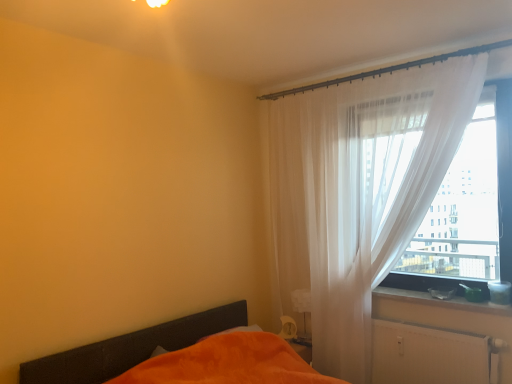
What do you see at coordinates (468, 207) in the screenshot? The height and width of the screenshot is (384, 512). I see `transparent fabric at right` at bounding box center [468, 207].

Where is `white matte radiator at lower right`? The width and height of the screenshot is (512, 384). white matte radiator at lower right is located at coordinates (430, 355).

Image resolution: width=512 pixels, height=384 pixels. What do you see at coordinates (430, 355) in the screenshot? I see `white matte radiator at lower right` at bounding box center [430, 355].

Locate an element on the screen. The width and height of the screenshot is (512, 384). white sheer curtain at right is located at coordinates (359, 192).

In order to face white sheer curtain at right, should I rotate leftwards or rightwards?

Rotate right and turn 14.914 degrees.

You are a GUI agent. You are given a task and a screenshot of the screen. Output one action in this format:
    pyautogui.click(x=<x>, y=<y>)
    Task: Click on the transparent fabric at right
    The image size is (512, 384).
    Given the screenshot: What is the action you would take?
    (x=468, y=207)

Which object is positioned more to the left, orange fabric bed at lower left or white sheer curtain at right?

orange fabric bed at lower left.

How different are the orientations of orange fabric bed at lower left and white sheer curtain at right in degrees?

The facing directions of orange fabric bed at lower left and white sheer curtain at right are 90 degrees apart.

From a real-world perspective, who is located lower, orange fabric bed at lower left or white sheer curtain at right?

orange fabric bed at lower left.

Is orange fabric bed at lower left further to camera compared to white sheer curtain at right?

No, it is not.

How different are the orientations of transparent fabric at right and orange fabric bed at lower left in degrees?

They differ by 90 degrees in their facing directions.

Can you confirm if transparent fabric at right is shorter than orange fabric bed at lower left?

No, transparent fabric at right is not shorter than orange fabric bed at lower left.

Is transparent fabric at right next to orange fabric bed at lower left?

transparent fabric at right and orange fabric bed at lower left are not in contact.

Is white sheer curtain at right far away from orange fabric bed at lower left?

Indeed, white sheer curtain at right is not near orange fabric bed at lower left.

Looking at the image, does white sheer curtain at right seem bigger or smaller compared to orange fabric bed at lower left?

Clearly, white sheer curtain at right is smaller in size than orange fabric bed at lower left.

In terms of width, does white sheer curtain at right look wider or thinner when compared to orange fabric bed at lower left?

white sheer curtain at right is thinner than orange fabric bed at lower left.

In terms of height, does white sheer curtain at right look taller or shorter compared to orange fabric bed at lower left?

Clearly, white sheer curtain at right is taller compared to orange fabric bed at lower left.

Considering the sizes of objects white matte radiator at lower right and white sheer curtain at right in the image provided, who is bigger, white matte radiator at lower right or white sheer curtain at right?

With larger size is white sheer curtain at right.

Would you say white matte radiator at lower right is a long distance from white sheer curtain at right?

That's not correct — white matte radiator at lower right is a little close to white sheer curtain at right.

Which object is closer to the camera taking this photo, white matte radiator at lower right or white sheer curtain at right?

white sheer curtain at right is more forward.

You are a GUI agent. You are given a task and a screenshot of the screen. Output one action in this format:
    pyautogui.click(x=<x>, y=<y>)
    Task: Click on the curtain above the white matte radiator at lower right (from a real-world perspective)
    The width and height of the screenshot is (512, 384).
    Given the screenshot: What is the action you would take?
    pyautogui.click(x=359, y=192)

From a real-world perspective, relative to matte plastic container at right, is white matte radiator at lower right vertically above or below?

In terms of real-world spatial position, white matte radiator at lower right is below matte plastic container at right.

Is white matte radiator at lower right not within matte plastic container at right?

Yes, white matte radiator at lower right is outside of matte plastic container at right.

Between white matte radiator at lower right and matte plastic container at right, which one has larger size?

Bigger between the two is white matte radiator at lower right.

Where is `window sill lying behind the white matte radiator at lower right`? window sill lying behind the white matte radiator at lower right is located at coordinates (440, 301).

Is white matte radiator at lower right at the right side of orange fabric bed at lower left?

Yes, white matte radiator at lower right is to the right of orange fabric bed at lower left.

Which object is further away from the camera taking this photo, white matte radiator at lower right or orange fabric bed at lower left?

white matte radiator at lower right is further from the camera.

From the image's perspective, which is below, white matte radiator at lower right or orange fabric bed at lower left?

orange fabric bed at lower left.

Is white matte radiator at lower right looking in the opposite direction of orange fabric bed at lower left?

No, white matte radiator at lower right's orientation is not away from orange fabric bed at lower left.

Considering the relative positions of matte plastic container at right and white sheer curtain at right in the image provided, is matte plastic container at right to the right of white sheer curtain at right from the viewer's perspective?

Indeed, matte plastic container at right is positioned on the right side of white sheer curtain at right.

From the picture: What's the angular difference between matte plastic container at right and white sheer curtain at right's facing directions?

The angle between the facing direction of matte plastic container at right and the facing direction of white sheer curtain at right is 1.26 degrees.

Is matte plastic container at right taller or shorter than white sheer curtain at right?

Clearly, matte plastic container at right is shorter compared to white sheer curtain at right.

From the image's perspective, is matte plastic container at right under white sheer curtain at right?

Yes, from the image's perspective, matte plastic container at right is beneath white sheer curtain at right.

This screenshot has height=384, width=512. I want to click on curtain on the right of orange fabric bed at lower left, so click(x=359, y=192).

Where is `window behind the orange fabric bed at lower left`? window behind the orange fabric bed at lower left is located at coordinates (468, 207).

Based on their spatial positions, is matte plastic container at right or transparent fabric at right further from white sheer curtain at right?

The object further to white sheer curtain at right is matte plastic container at right.

Considering their positions, is orange fabric bed at lower left positioned closer to matte plastic container at right than transparent fabric at right?

The object closer to matte plastic container at right is transparent fabric at right.

When comparing their distances from transparent fabric at right, does orange fabric bed at lower left or matte plastic container at right seem closer?

The object closer to transparent fabric at right is matte plastic container at right.

When comparing their distances from orange fabric bed at lower left, does matte plastic container at right or transparent fabric at right seem closer?

Among the two, matte plastic container at right is located nearer to orange fabric bed at lower left.

When comparing their distances from transparent fabric at right, does white sheer curtain at right or orange fabric bed at lower left seem further?

orange fabric bed at lower left is further to transparent fabric at right.

From the image, which object appears to be farther from transparent fabric at right, white matte radiator at lower right or white sheer curtain at right?

white matte radiator at lower right lies further to transparent fabric at right than the other object.

From the image, which object appears to be nearer to white matte radiator at lower right, orange fabric bed at lower left or white sheer curtain at right?

Among the two, white sheer curtain at right is located nearer to white matte radiator at lower right.

Which object lies nearer to the anchor point transparent fabric at right, white matte radiator at lower right or orange fabric bed at lower left?

Based on the image, white matte radiator at lower right appears to be nearer to transparent fabric at right.

I want to click on curtain between transparent fabric at right and white matte radiator at lower right from top to bottom, so click(359, 192).

This screenshot has width=512, height=384. In order to click on radiator located between orange fabric bed at lower left and matte plastic container at right in the depth direction in this screenshot , I will do `click(430, 355)`.

Find the location of `radiator between orange fabric bed at lower left and transparent fabric at right in the front-back direction`. radiator between orange fabric bed at lower left and transparent fabric at right in the front-back direction is located at coordinates coord(430,355).

I want to click on curtain positioned between orange fabric bed at lower left and transparent fabric at right from near to far, so click(x=359, y=192).